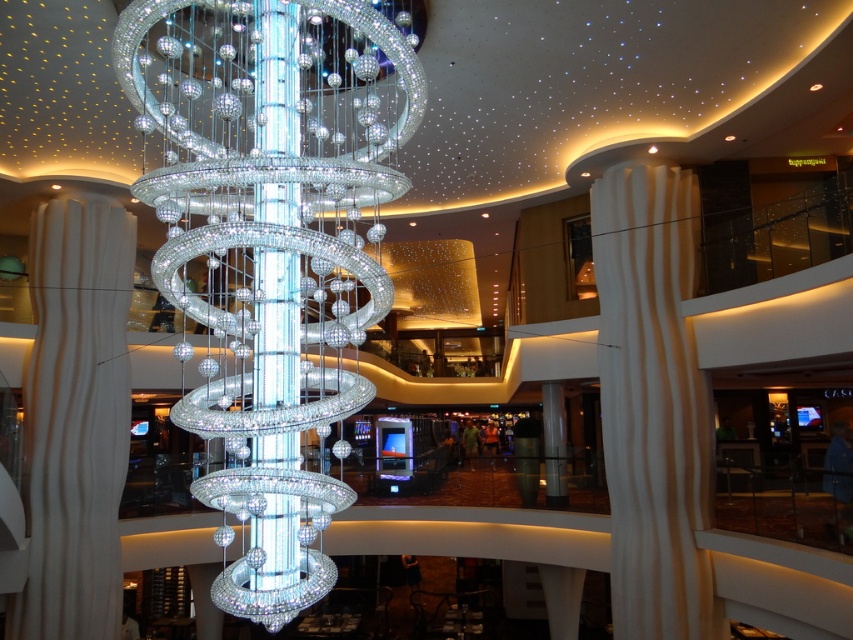
Question: Which point is farther from the camera taking this photo?

Choices:
 (A) (682, 433)
 (B) (225, 10)

Answer: (A)

Question: Which point is farther to the camera?

Choices:
 (A) (672, 192)
 (B) (254, 243)

Answer: (A)

Question: Can you confirm if clear crystal chandelier at center is bigger than white textured column at center?

Choices:
 (A) no
 (B) yes

Answer: (A)

Question: Is clear crystal chandelier at center above white textured column at center?

Choices:
 (A) yes
 (B) no

Answer: (A)

Question: Is clear crystal chandelier at center to the right of white textured column at center from the viewer's perspective?

Choices:
 (A) no
 (B) yes

Answer: (A)